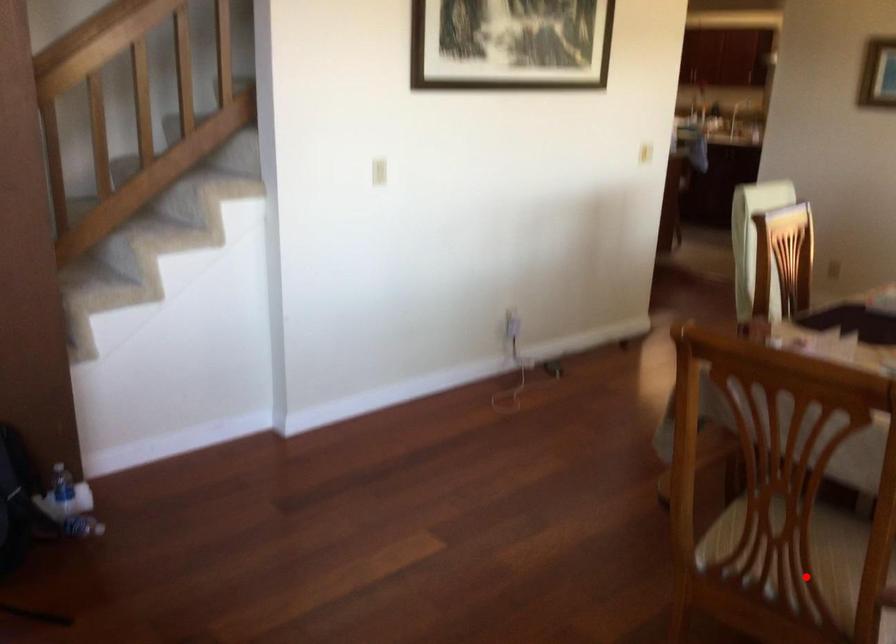
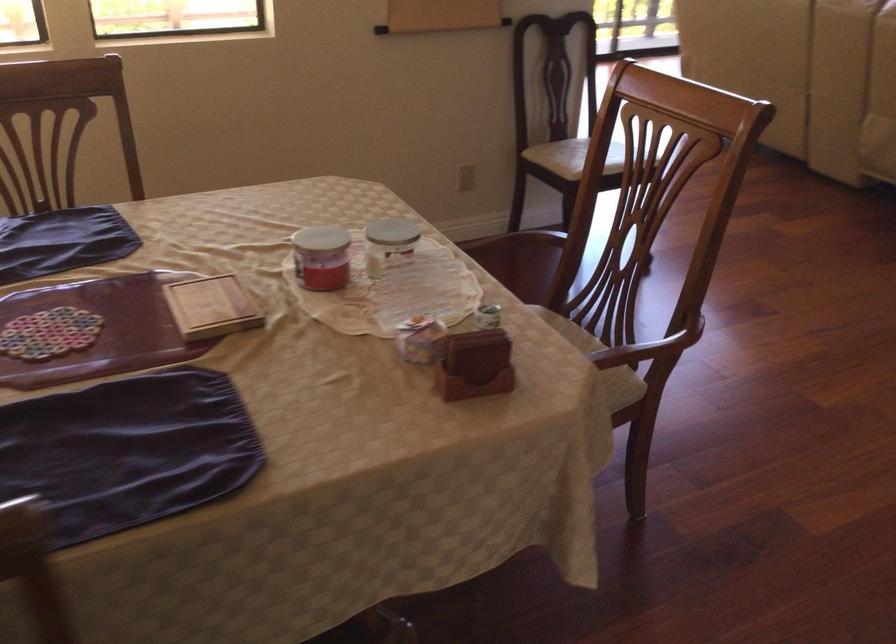
Locate, in the second image, the point that corresponds to the highlighted location in the first image.

(564, 322)